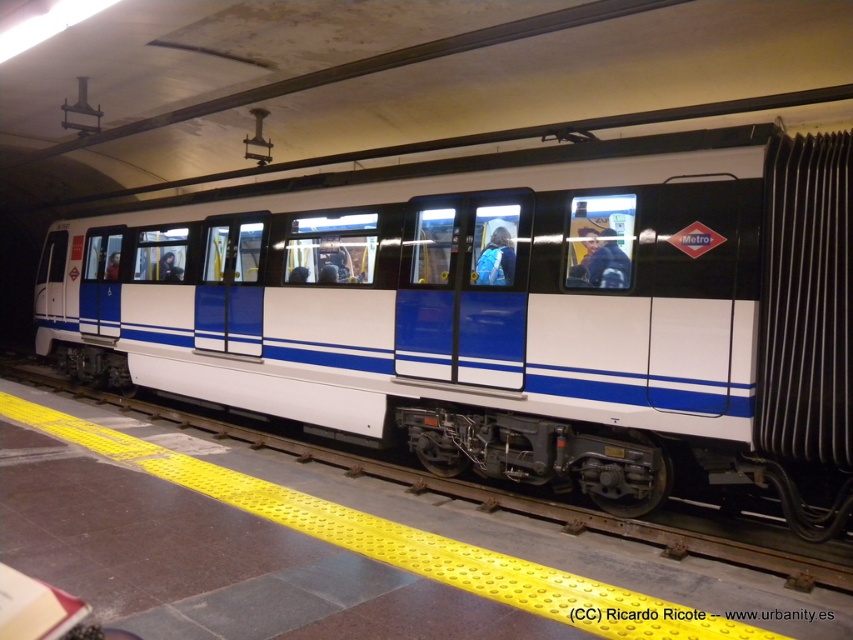
Question: Observing the image, what is the correct spatial positioning of blue fabric backpack at center in reference to dark blue fabric jacket at center?

Choices:
 (A) left
 (B) right

Answer: (B)

Question: Can you confirm if white glossy train at center is positioned below matte blue jacket at center?

Choices:
 (A) no
 (B) yes

Answer: (B)

Question: Which point is closer to the camera taking this photo?

Choices:
 (A) (611, 234)
 (B) (503, 259)
 (C) (171, 266)
 (D) (328, 300)

Answer: (A)

Question: Which point appears closest to the camera in this image?

Choices:
 (A) (157, 269)
 (B) (585, 284)
 (C) (201, 195)

Answer: (B)

Question: In this image, where is white glossy train at center located relative to blue fabric backpack at center?

Choices:
 (A) right
 (B) left

Answer: (B)

Question: Estimate the real-world distances between objects in this image. Which object is closer to the matte blue jacket at center?

Choices:
 (A) white glossy train at center
 (B) dark blue fabric jacket at center

Answer: (A)